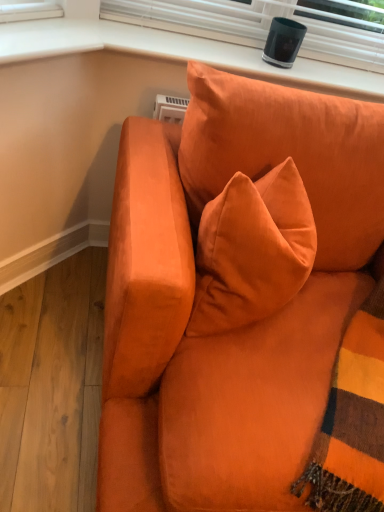
Question: Considering the relative sizes of matte orange couch at center and matte black speaker at upper center in the image provided, is matte orange couch at center shorter than matte black speaker at upper center?

Choices:
 (A) yes
 (B) no

Answer: (B)

Question: From a real-world perspective, does matte orange couch at center stand above matte black speaker at upper center?

Choices:
 (A) no
 (B) yes

Answer: (A)

Question: From a real-world perspective, is matte orange couch at center below matte black speaker at upper center?

Choices:
 (A) yes
 (B) no

Answer: (A)

Question: Does matte orange couch at center have a lesser width compared to matte black speaker at upper center?

Choices:
 (A) no
 (B) yes

Answer: (A)

Question: Is matte orange couch at center positioned behind matte black speaker at upper center?

Choices:
 (A) yes
 (B) no

Answer: (B)

Question: Is matte orange couch at center to the right of matte black speaker at upper center from the viewer's perspective?

Choices:
 (A) yes
 (B) no

Answer: (A)

Question: From a real-world perspective, is matte black speaker at upper center located beneath matte orange couch at center?

Choices:
 (A) yes
 (B) no

Answer: (B)

Question: Is there a large distance between matte black speaker at upper center and matte orange couch at center?

Choices:
 (A) no
 (B) yes

Answer: (A)

Question: Can you confirm if matte black speaker at upper center is taller than matte orange couch at center?

Choices:
 (A) no
 (B) yes

Answer: (A)

Question: Is matte black speaker at upper center positioned before matte orange couch at center?

Choices:
 (A) no
 (B) yes

Answer: (A)

Question: Considering the relative sizes of matte black speaker at upper center and matte orange couch at center in the image provided, is matte black speaker at upper center bigger than matte orange couch at center?

Choices:
 (A) yes
 (B) no

Answer: (B)

Question: From the image's perspective, is matte black speaker at upper center on top of matte orange couch at center?

Choices:
 (A) yes
 (B) no

Answer: (A)

Question: From the image's perspective, relative to matte black speaker at upper center, is matte orange couch at center above or below?

Choices:
 (A) above
 (B) below

Answer: (B)